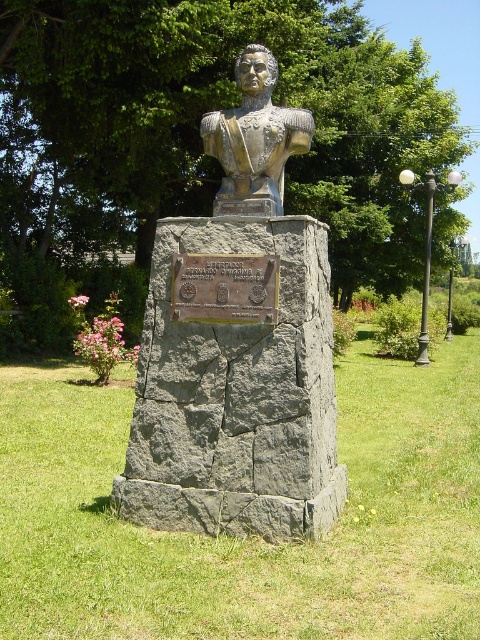
Question: Can you confirm if gold-bronze bust at center is thinner than bronze plaque at center?

Choices:
 (A) yes
 (B) no

Answer: (B)

Question: Considering the real-world distances, which object is closest to the bronze plaque at center?

Choices:
 (A) shiny bronze bust at center
 (B) gold-bronze bust at center

Answer: (B)

Question: Is shiny bronze bust at center wider than bronze plaque at center?

Choices:
 (A) yes
 (B) no

Answer: (A)

Question: Does gold-bronze bust at center have a greater width compared to bronze plaque at center?

Choices:
 (A) no
 (B) yes

Answer: (B)

Question: Among these points, which one is nearest to the camera?

Choices:
 (A) (182, 262)
 (B) (282, 172)

Answer: (A)

Question: Which point appears closest to the camera in this image?

Choices:
 (A) (183, 294)
 (B) (256, 166)
 (C) (283, 278)

Answer: (C)